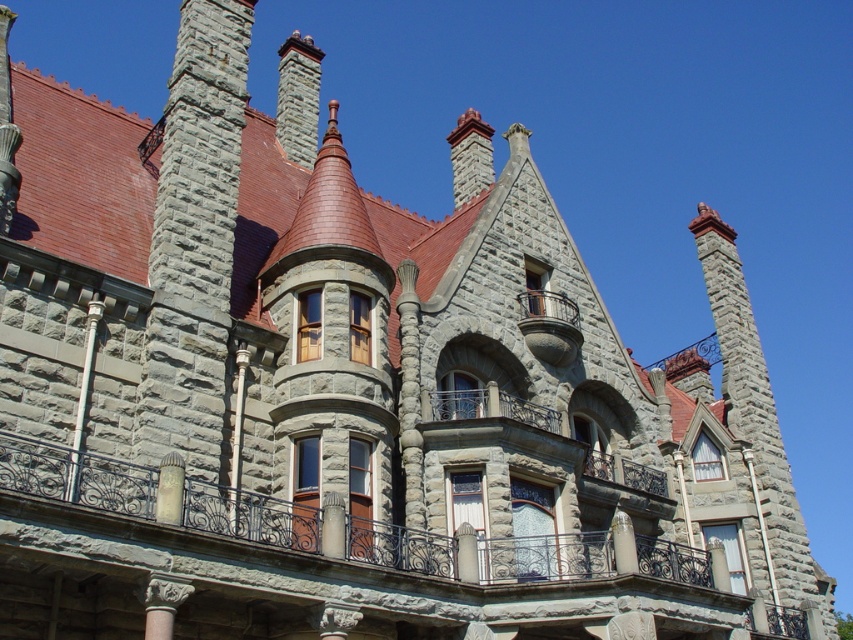
Question: Does gray stone chimney at left have a lesser width compared to gray stone chimney at upper center?

Choices:
 (A) yes
 (B) no

Answer: (A)

Question: Which point appears farthest from the camera in this image?

Choices:
 (A) (804, 580)
 (B) (311, 38)
 (C) (579, 417)

Answer: (B)

Question: Does gray stone chimney at left appear on the left side of gray stone chimney at upper center?

Choices:
 (A) yes
 (B) no

Answer: (B)

Question: Considering the real-world distances, which object is farthest from the gray stone chimney at left?

Choices:
 (A) stone balcony at center
 (B) gray stone chimney at right

Answer: (B)

Question: Which object is farther from the camera taking this photo?

Choices:
 (A) stone balcony at center
 (B) gray stone chimney at upper center
 (C) stone wrought iron balcony at center

Answer: (B)

Question: Can you confirm if gray stone chimney at right is wider than gray stone chimney at upper center?

Choices:
 (A) yes
 (B) no

Answer: (B)